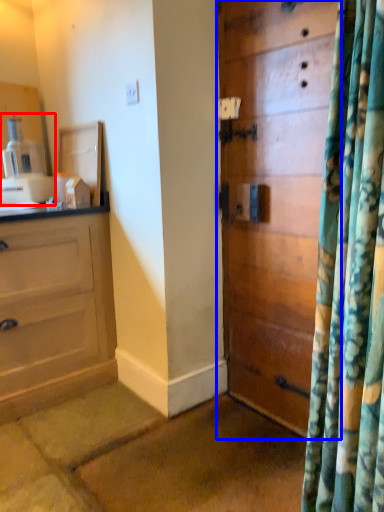
Question: Which point is further to the camera, coffee machine (highlighted by a red box) or door (highlighted by a blue box)?

Choices:
 (A) coffee machine
 (B) door

Answer: (A)